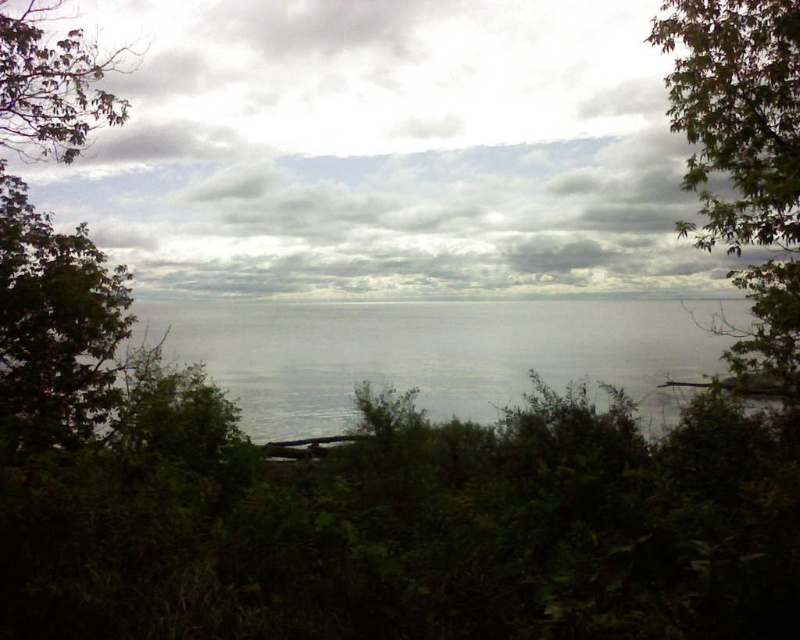
Question: Which object is the farthest from the green leafy tree at left?

Choices:
 (A) green leafy tree at upper right
 (B) cloudy sky at center
 (C) green leafy shrubs at lower center
 (D) transparent water at center

Answer: (A)

Question: Among these objects, which one is nearest to the camera?

Choices:
 (A) transparent water at center
 (B) cloudy sky at center

Answer: (A)

Question: Is cloudy sky at center closer to the viewer compared to transparent water at center?

Choices:
 (A) no
 (B) yes

Answer: (A)

Question: Which of these objects is positioned closest to the transparent water at center?

Choices:
 (A) green leafy tree at left
 (B) green leafy tree at upper right
 (C) green leafy shrubs at lower center

Answer: (A)

Question: Does green leafy shrubs at lower center appear on the left side of green leafy tree at upper right?

Choices:
 (A) no
 (B) yes

Answer: (B)

Question: Can you confirm if transparent water at center is bigger than green leafy tree at upper right?

Choices:
 (A) no
 (B) yes

Answer: (A)